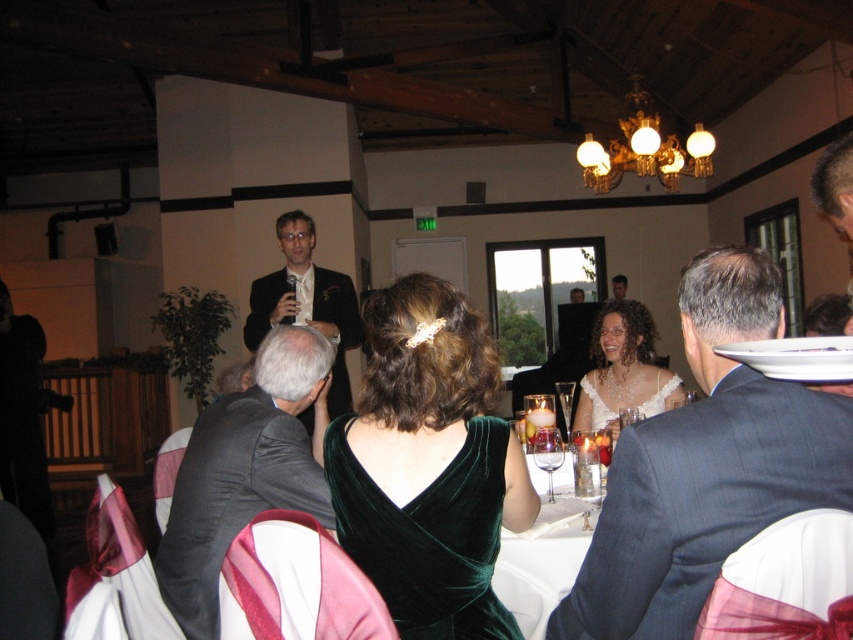
You are a photographer at the event and need to adjust the camera height to capture both the dark blue suit at center and the dark gray suit at center in the same frame. Which suit should you focus on first to ensure both are in view?

The dark blue suit at center is shorter than the dark gray suit at center. To capture both in the same frame, focus on the dark gray suit at center first, then adjust the camera angle to include the shorter dark blue suit at center.

You are a photographer at the event and need to seat two guests wearing dark blue suit at center and dark gray suit at center next to each other. Given that the chairs are spaced 1 meter apart, will their combined width fit within the space?

The dark blue suit at center has a smaller width than the dark gray suit at center, but the combined width of both suits is not provided. However, since the chairs are spaced 1 meter apart, and assuming typical suit widths, it is likely they can fit together within the space.

You are a photographer at the event and need to capture a photo of the dark gray suit at center. If you stand 6 feet away from the subject, will you be able to take the photo without moving closer?

The photographer is 5.86 feet away from the dark gray suit at center, which is less than 6 feet. Therefore, you can take the photo without moving closer.